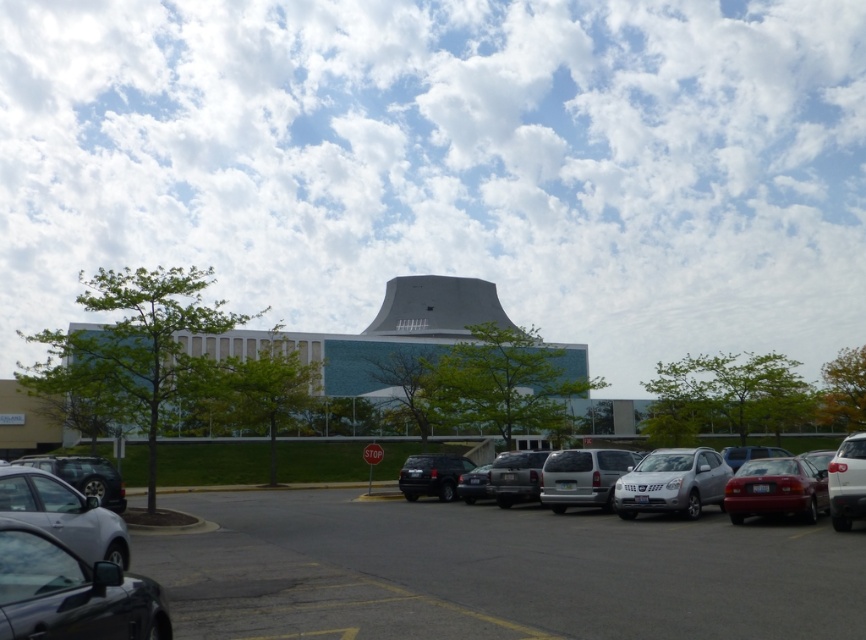
You are a delivery driver who needs to park your truck, which is 2 meters wide, in the parking lot. Based on the scene, can you fit your truck between the dark gray asphalt parking lot at center and the shiny black car at lower left?

The dark gray asphalt parking lot at center might be wider than the shiny black car at lower left, so there is a possibility that the parking space between them could accommodate a truck that is 2 meters wide. However, without exact measurements, it is uncertain. You should check the available space carefully before attempting to park.

You are a delivery driver who needs to back out of your parking spot between the shiny silver suv at right and the shiny black suv at lower left. The space between them is narrow. Can you safely maneuver your truck, which is 2.5 meters wide, through the gap without touching either vehicle?

The distance between the shiny silver suv at right and the shiny black suv at lower left is 18.96 meters. Since your truck is only 2.5 meters wide, there is ample space to maneuver safely without touching either vehicle.